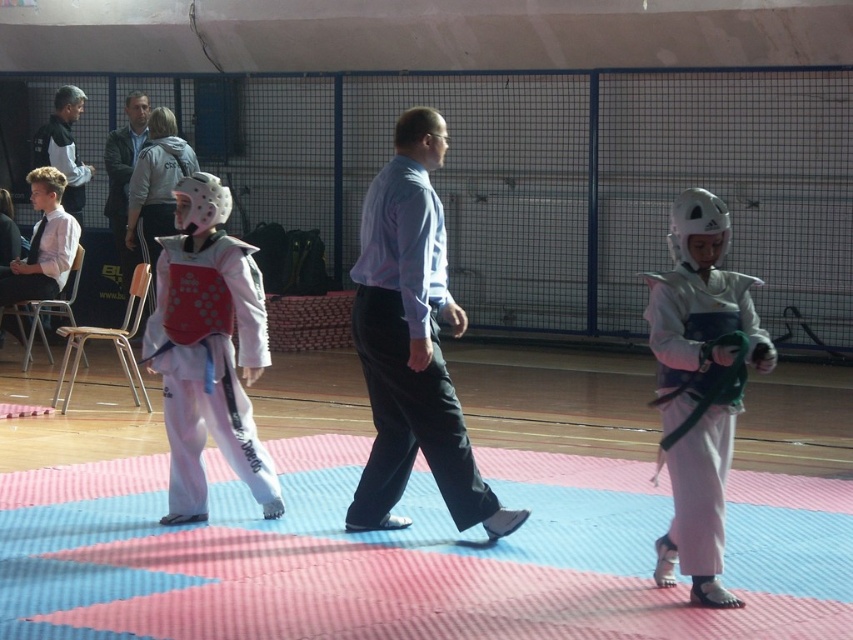
Does light blue shirt at center appear under white matte karate uniform at left?

Actually, light blue shirt at center is above white matte karate uniform at left.

Locate an element on the screen. This screenshot has width=853, height=640. light blue shirt at center is located at coordinates (412, 342).

Between white matte karate uniform at right and light blue shirt at upper center, which one is positioned higher?

Positioned higher is light blue shirt at upper center.

Is white matte karate uniform at right bigger than light blue shirt at upper center?

Actually, white matte karate uniform at right might be smaller than light blue shirt at upper center.

Is point (701, 225) farther from camera compared to point (138, 109)?

That is False.

In order to click on white matte karate uniform at right in this screenshot , I will do `click(700, 385)`.

Does point (260, 285) come behind point (35, 150)?

No.

Can you confirm if white matte karate uniform at left is positioned to the left of black jacket at upper left?

Incorrect, white matte karate uniform at left is not on the left side of black jacket at upper left.

In order to click on white matte karate uniform at left in this screenshot , I will do `click(207, 349)`.

Find the location of a particular element. white matte karate uniform at left is located at coordinates (207, 349).